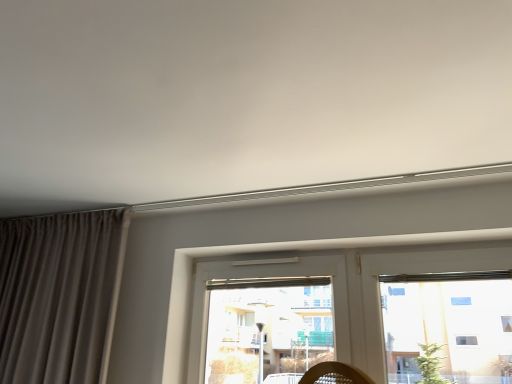
Question: In terms of size, does matte gray curtain at left appear bigger or smaller than transparent glass window at center?

Choices:
 (A) small
 (B) big

Answer: (B)

Question: In terms of height, does matte gray curtain at left look taller or shorter compared to transparent glass window at center?

Choices:
 (A) tall
 (B) short

Answer: (A)

Question: In the image, is matte gray curtain at left on the left side or the right side of transparent glass window at center?

Choices:
 (A) right
 (B) left

Answer: (B)

Question: Is transparent glass window at center inside the boundaries of matte gray curtain at left, or outside?

Choices:
 (A) outside
 (B) inside

Answer: (A)

Question: From the image's perspective, is transparent glass window at center above or below matte gray curtain at left?

Choices:
 (A) above
 (B) below

Answer: (B)

Question: Is point [x=400, y=279] positioned closer to the camera than point [x=58, y=332]?

Choices:
 (A) farther
 (B) closer

Answer: (B)

Question: Based on their sizes in the image, would you say transparent glass window at center is bigger or smaller than matte gray curtain at left?

Choices:
 (A) small
 (B) big

Answer: (A)